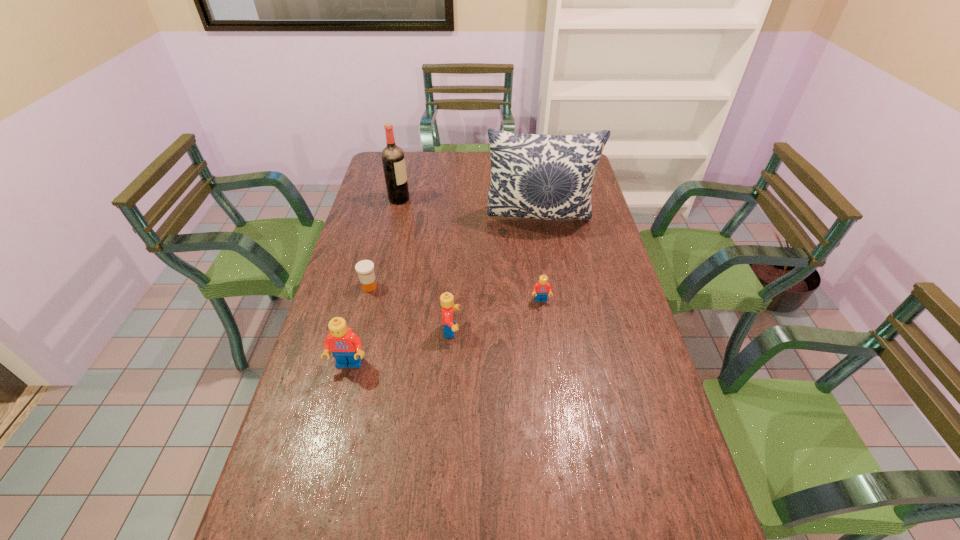
Considering the uniform spacing of Legos, where should an additional Lego be positioned on the right? Please locate a free spot. Please provide its 2D coordinates. Your answer should be formatted as a tuple, i.e. [(x, y)], where the tuple contains the x and y coordinates of a point satisfying the conditions above.

[(620, 274)]